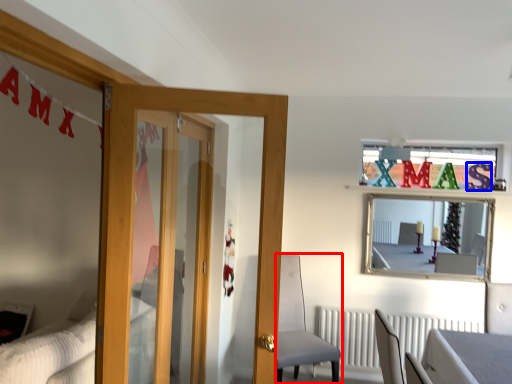
Question: Which point is further to the camera, chair (highlighted by a red box) or letter (highlighted by a blue box)?

Choices:
 (A) chair
 (B) letter

Answer: (B)